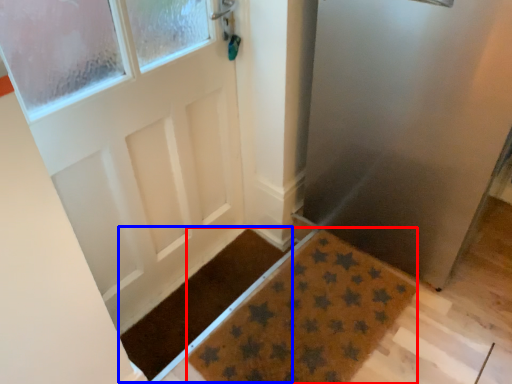
Question: Which object is further to the camera taking this photo, doormat (highlighted by a red box) or doormat (highlighted by a blue box)?

Choices:
 (A) doormat
 (B) doormat

Answer: (B)